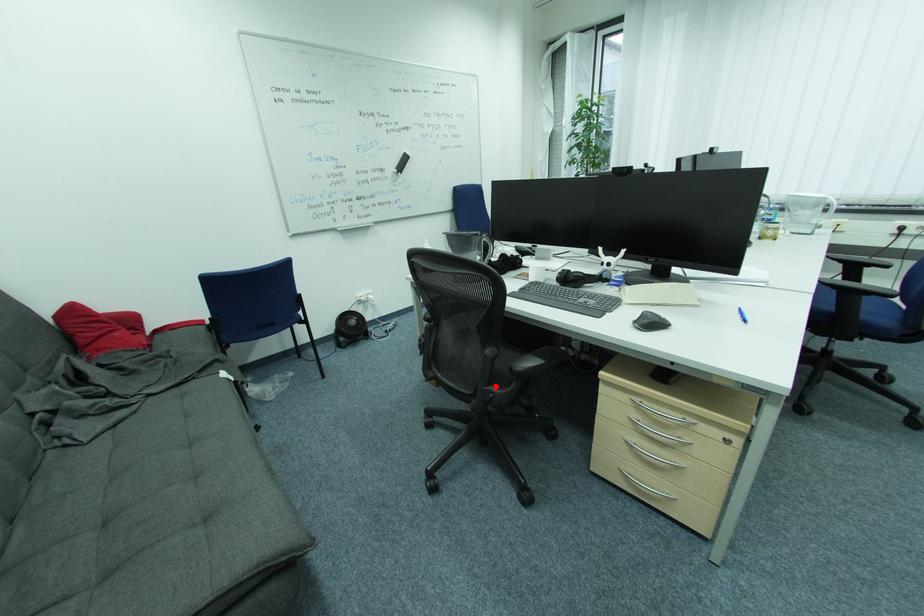
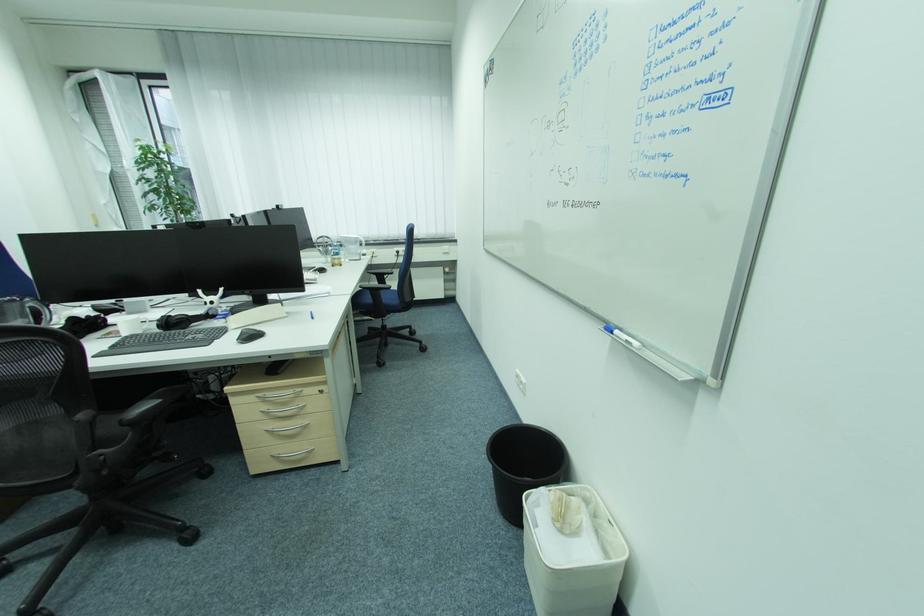
Question: I am providing you with two images of the same scene from different viewpoints. Given a red point in image1, look at the same physical point in image2. Is it:

Choices:
 (A) Closer to the viewpoint
 (B) Farther from the viewpoint

Answer: (A)